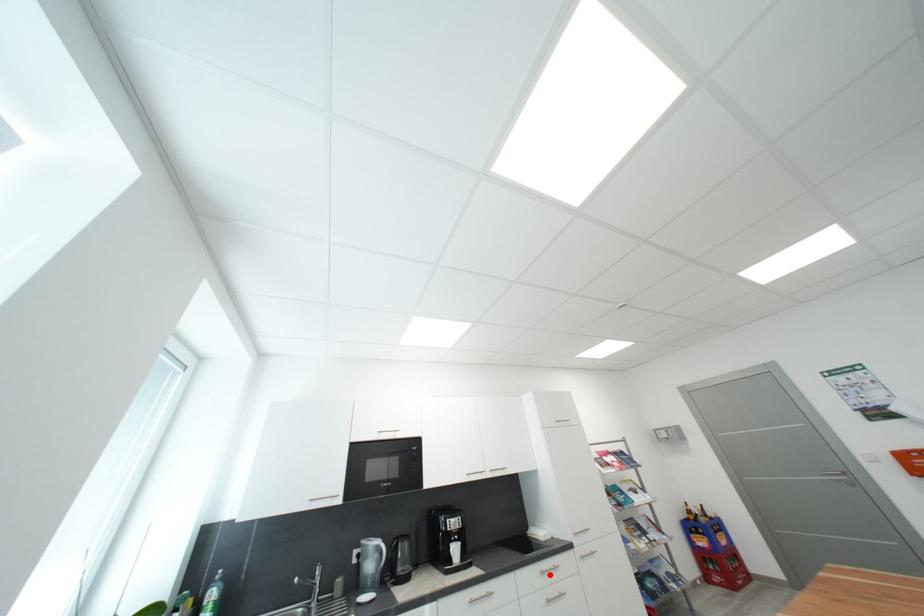
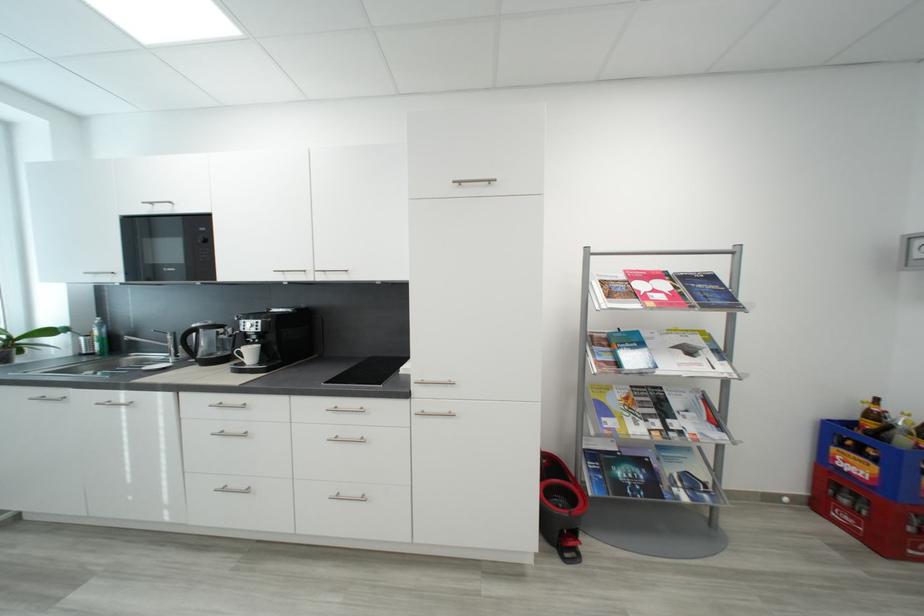
Question: I am providing you with two images of the same scene from different viewpoints. Image1 has a red point marked. In image2, the corresponding 3D location appears at what relative position? Reply with the corresponding letter.

Choices:
 (A) Closer
 (B) Farther

Answer: (B)